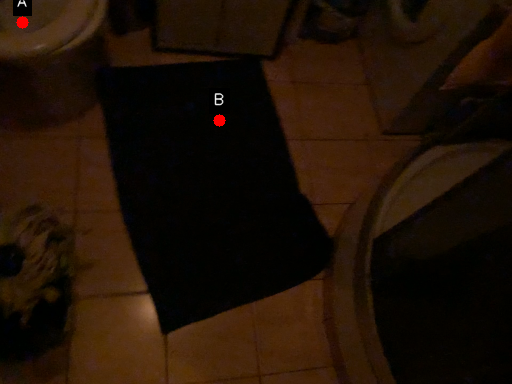
Question: Two points are circled on the image, labeled by A and B beside each circle. Which point is farther to the camera?

Choices:
 (A) A is further
 (B) B is further

Answer: (B)